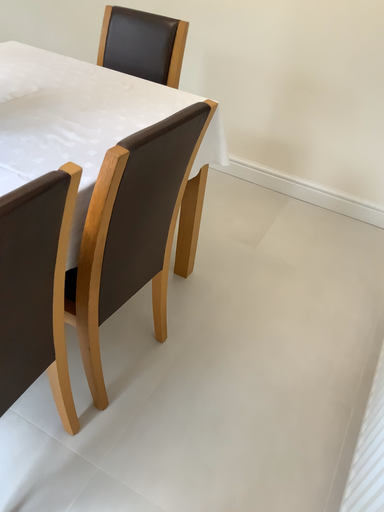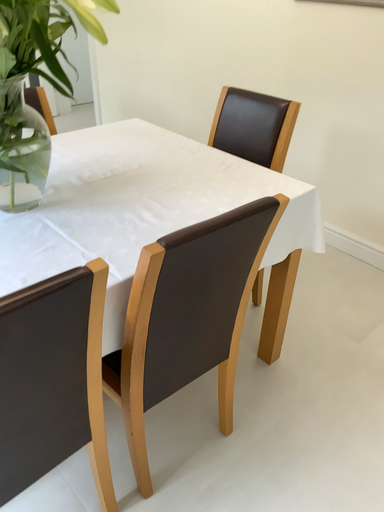
Question: Which way did the camera rotate in the video?

Choices:
 (A) rotated downward
 (B) rotated upward

Answer: (B)